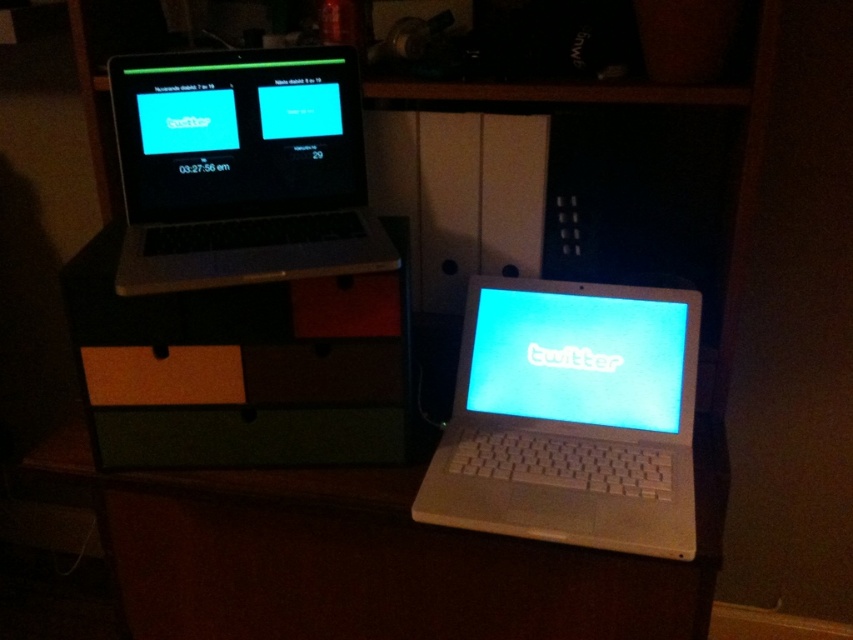
You are a photographer standing in front of the white plastic laptop at center. You want to take a clear photo of it without any blur. The camera you are using has a minimum focusing distance of 30 inches. Can you take the photo without moving closer than the minimum distance?

The distance of white plastic laptop at center from camera is 31.12 inches, which is beyond the camera minimum focusing distance of 30 inches. Therefore, you can take the photo without moving closer.

Based on the photo, you are organizing a tech exhibition and need to place both the white plastic laptop at center and the satin black laptop at upper left on a shelf. The shelf has a maximum width capacity of 1.2 meters. If the combined width of both laptops is 1.1 meters, can both fit on the shelf without exceeding its capacity?

The combined width of the white plastic laptop at center and the satin black laptop at upper left is 1.1 meters, which is under the shelf capacity of 1.2 meters. Therefore, both can fit on the shelf.